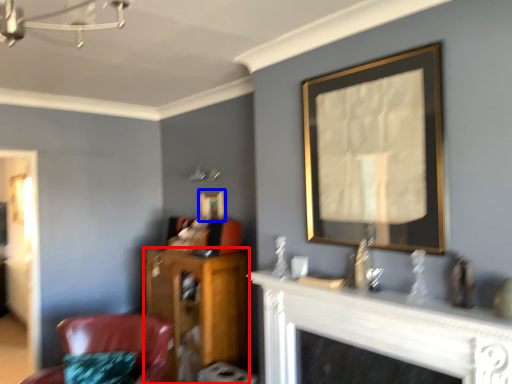
Question: Among these objects, which one is nearest to the camera, furniture (highlighted by a red box) or picture frame (highlighted by a blue box)?

Choices:
 (A) furniture
 (B) picture frame

Answer: (A)